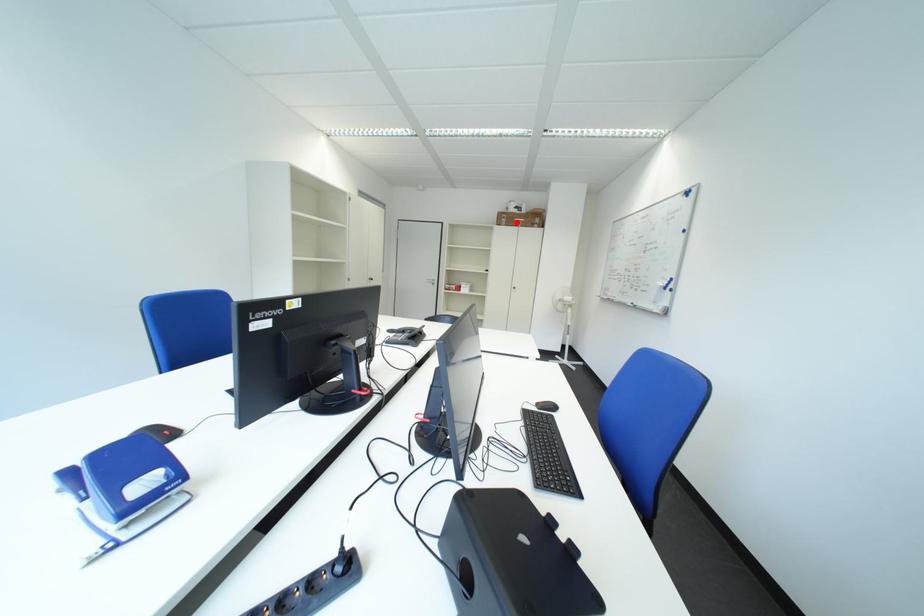
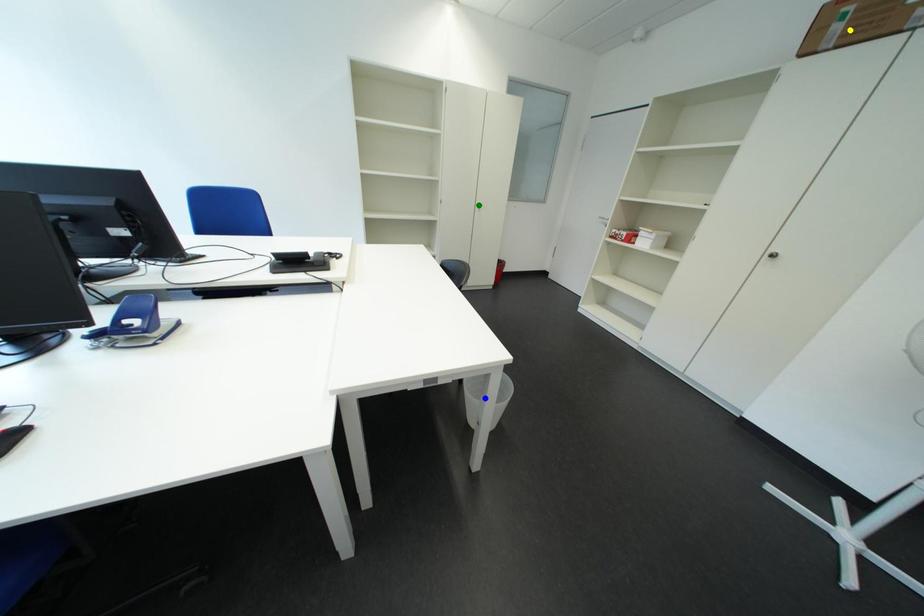
Question: I am providing you with two images of the same scene from different viewpoints. A red point is marked on the first image. You are given multiple points on the second image. In image 2, which mark is for the same physical point as the one in image 1?

Choices:
 (A) blue point
 (B) green point
 (C) yellow point

Answer: (C)